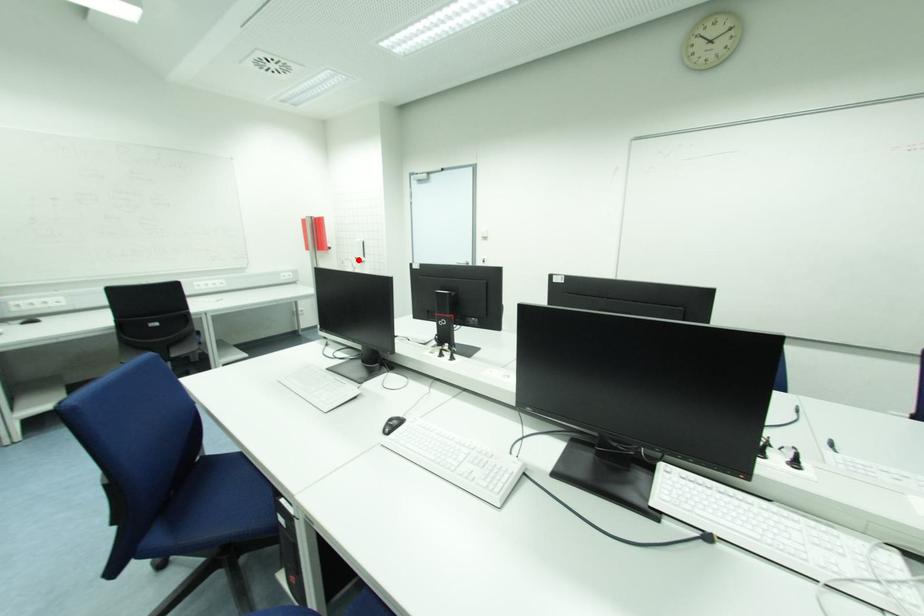
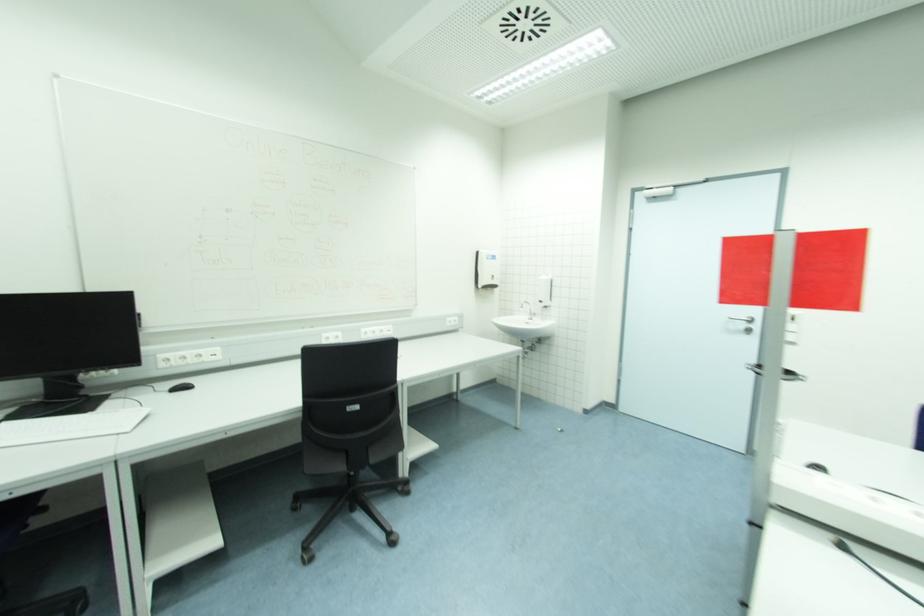
In the second image, find the point that corresponds to the highlighted location in the first image.

(543, 302)